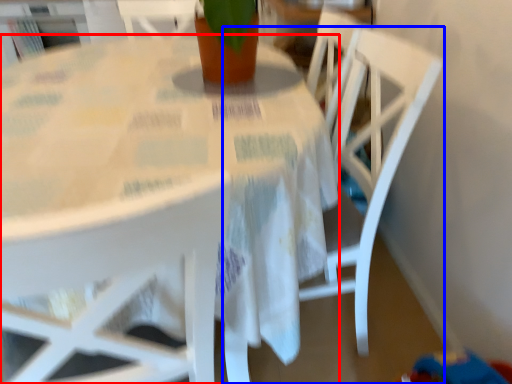
Question: Among these objects, which one is nearest to the camera, table (highlighted by a red box) or chair (highlighted by a blue box)?

Choices:
 (A) table
 (B) chair

Answer: (A)